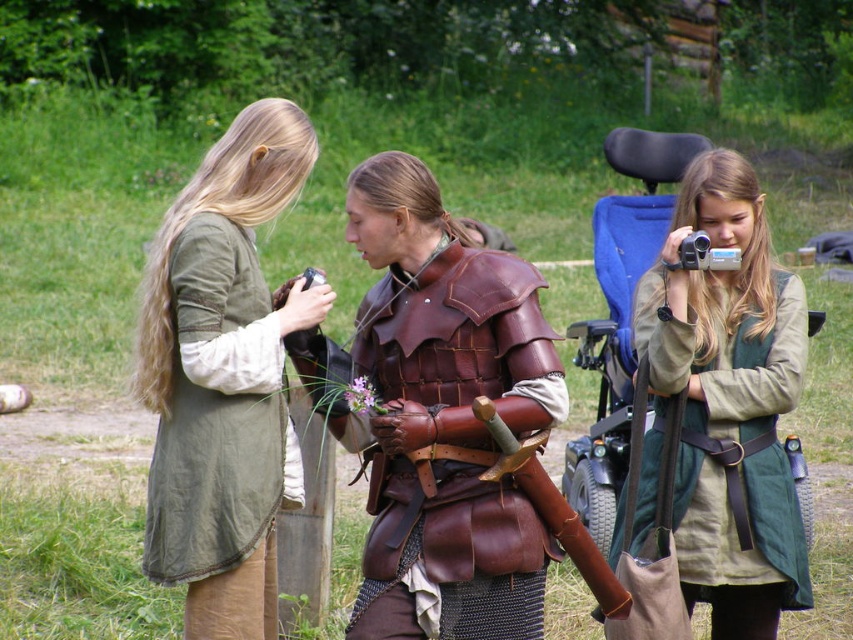
Question: Which object is closer to the camera taking this photo?

Choices:
 (A) leather armor at center
 (B) green linen tunic at left
 (C) green canvas tunic at center

Answer: (A)

Question: Is green linen tunic at left below leather armor at center?

Choices:
 (A) yes
 (B) no

Answer: (B)

Question: Is green linen tunic at left positioned at the back of green canvas tunic at center?

Choices:
 (A) yes
 (B) no

Answer: (A)

Question: Which of these objects is positioned closest to the green linen tunic at left?

Choices:
 (A) leather armor at center
 (B) green canvas tunic at center

Answer: (A)

Question: Does green linen tunic at left appear under green canvas tunic at center?

Choices:
 (A) no
 (B) yes

Answer: (A)

Question: Which point appears farthest from the camera in this image?

Choices:
 (A) (741, 605)
 (B) (440, 417)

Answer: (A)